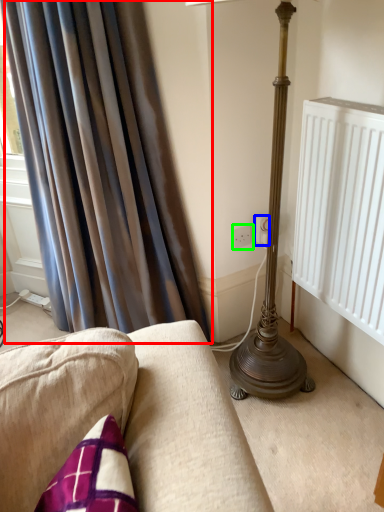
Question: Estimate the real-world distances between objects in this image. Which object is farther from curtain (highlighted by a red box), electric outlet (highlighted by a blue box) or electric outlet (highlighted by a green box)?

Choices:
 (A) electric outlet
 (B) electric outlet

Answer: (A)